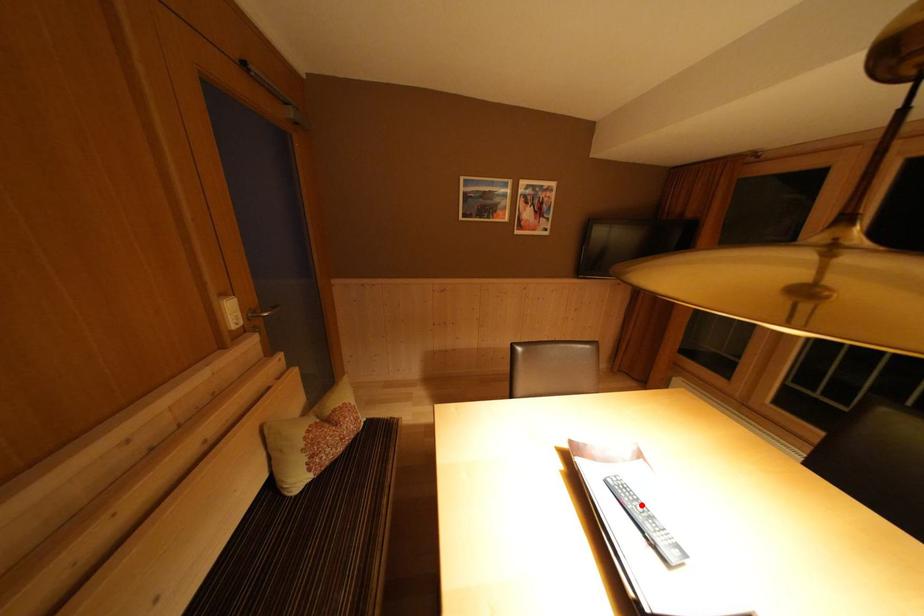
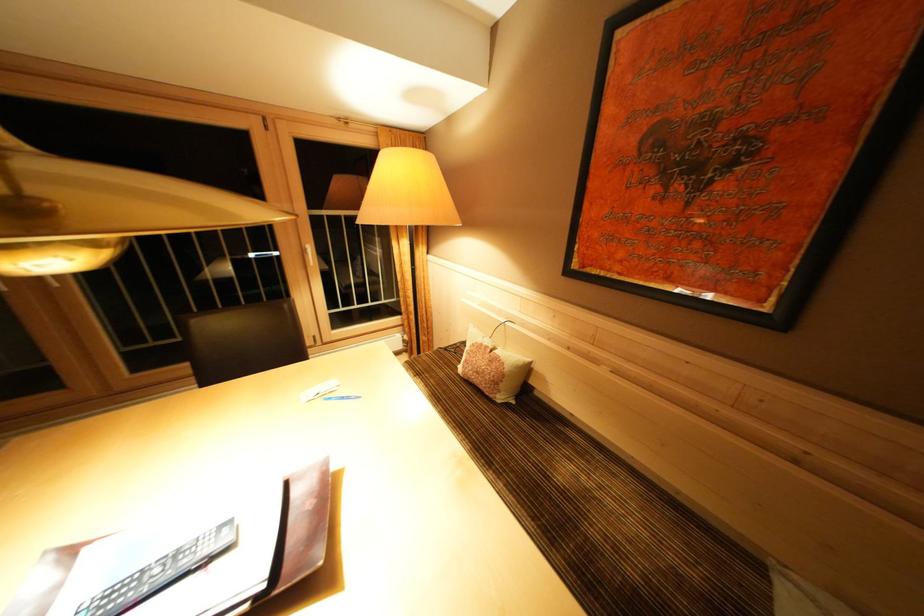
Question: I am providing you with two images of the same scene from different viewpoints. A red point is marked on the first image. Is the red point's position out of view in image 2?

Choices:
 (A) Yes
 (B) No

Answer: (B)